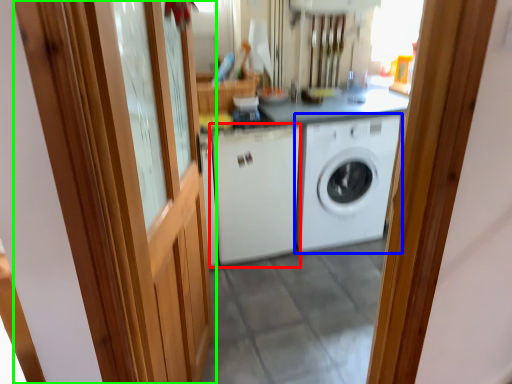
Question: Considering the real-world distances, which object is farthest from washing machine (highlighted by a red box)? washing machine (highlighted by a blue box) or barn door (highlighted by a green box)?

Choices:
 (A) washing machine
 (B) barn door

Answer: (B)